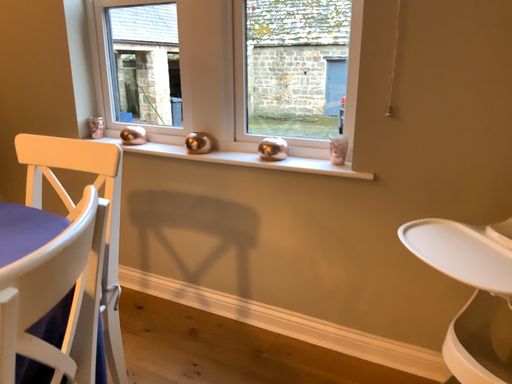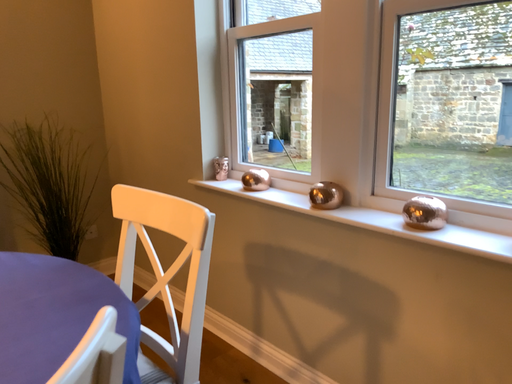
Question: Which way did the camera rotate in the video?

Choices:
 (A) rotated left
 (B) rotated right

Answer: (A)